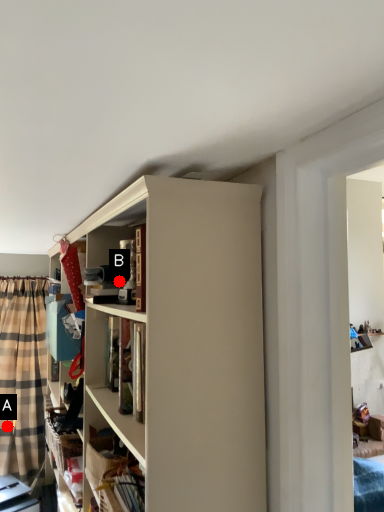
Question: Two points are circled on the image, labeled by A and B beside each circle. Which point is farther from the camera taking this photo?

Choices:
 (A) A is further
 (B) B is further

Answer: (A)